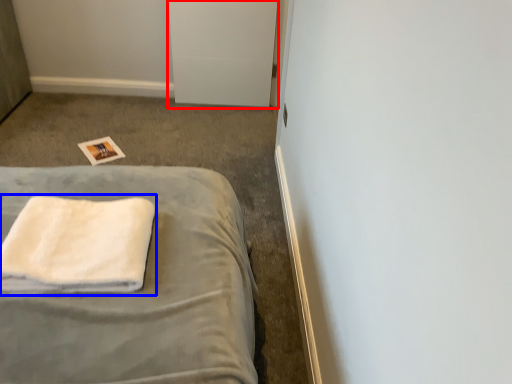
Question: Which object appears closest to the camera in this image, file cabinet (highlighted by a red box) or towel (highlighted by a blue box)?

Choices:
 (A) file cabinet
 (B) towel

Answer: (B)